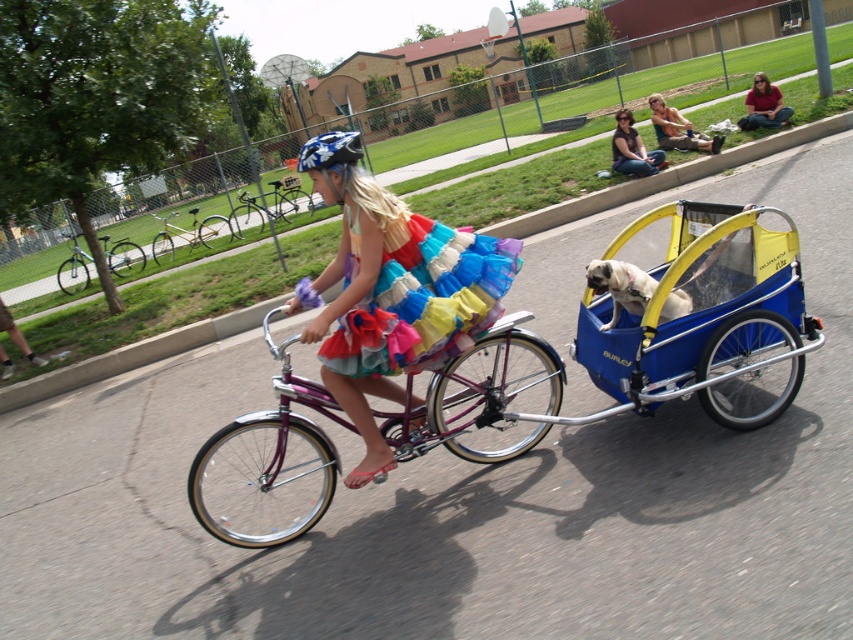
You are a delivery drone flying above the park. You need to drop off a package to the person wearing the multicolored tulle dress at center. However, there is a blue textured helmet at center in the way. Can you safely drop the package without hitting the helmet?

The distance between the multicolored tulle dress at center and the blue textured helmet at center is 36.32 inches, so the drone can safely drop the package as there is enough space between them.

You are a photographer trying to capture the girl in the scene. You need to ensure that both the multicolored tulle dress at center and the blue textured helmet at center are clearly visible in your shot. Given their sizes, which object should you focus on to ensure both are in frame without needing to zoom in or out excessively?

The multicolored tulle dress at center is narrower than the blue textured helmet at center. To ensure both are in frame without adjusting the zoom, focus on the larger object, the blue textured helmet at center, as its size will help maintain the smaller dress within the shot.

From the picture: You are a photographer trying to capture the scene of the girl riding her bicycle. You notice the blue textured helmet at center and the matte red shirt at upper right in your viewfinder. Which object should you zoom in on to ensure both are fully visible without cropping, considering their sizes?

The blue textured helmet at center is wider than the matte red shirt at upper right. To ensure both are fully visible without cropping, you should zoom in on the blue textured helmet at center since it is the wider object and requires more space.